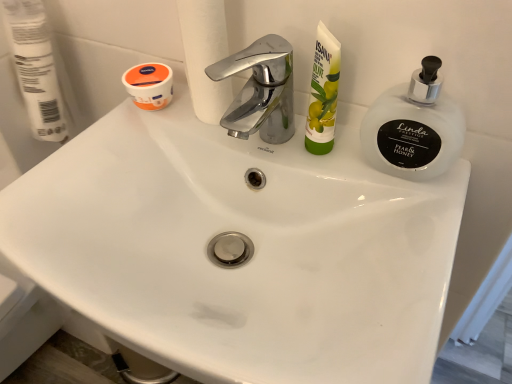
Find the location of `vacant space positioned to the left of green matte tube at upper right`. vacant space positioned to the left of green matte tube at upper right is located at coordinates (213, 148).